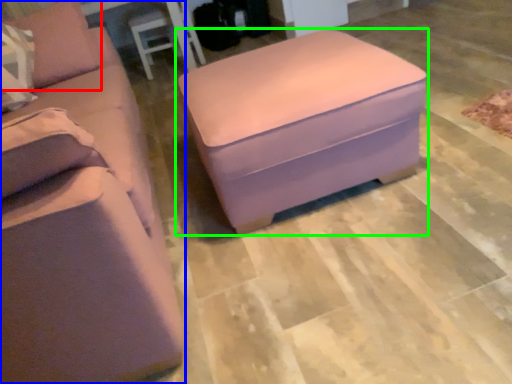
Question: Which is nearer to the pillow (highlighted by a red box)? studio couch (highlighted by a blue box) or table (highlighted by a green box).

Choices:
 (A) studio couch
 (B) table

Answer: (A)